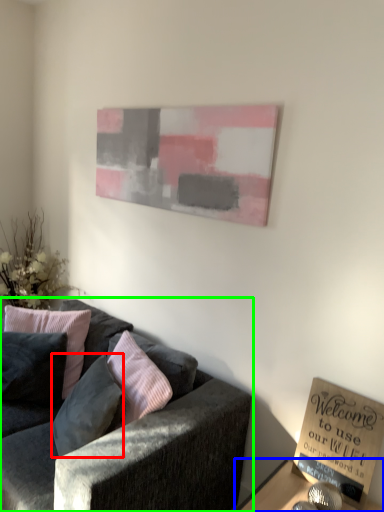
Question: Which object is the farthest from pillow (highlighted by a red box)? Choose among these: table (highlighted by a blue box) or studio couch (highlighted by a green box).

Choices:
 (A) table
 (B) studio couch

Answer: (A)